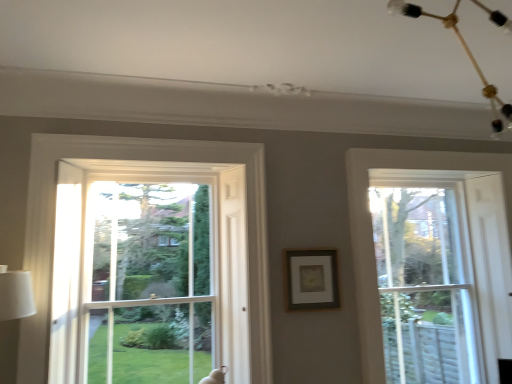
Identify the location of matte gold picture frame at center. (311, 279).

The height and width of the screenshot is (384, 512). I want to click on clear glass window at right, so click(x=371, y=228).

Where is `clear glass window screen at center`? This screenshot has height=384, width=512. clear glass window screen at center is located at coordinates (151, 284).

Is gold metallic chandelier at upper right wider than clear glass window screen at center?

Yes.

Is gold metallic chandelier at upper right facing towards clear glass window screen at center?

No, gold metallic chandelier at upper right does not turn towards clear glass window screen at center.

Is gold metallic chandelier at upper right not within clear glass window screen at center?

Yes, gold metallic chandelier at upper right is located beyond the bounds of clear glass window screen at center.

Looking at this image, from a real-world perspective, is gold metallic chandelier at upper right located higher than clear glass window screen at center?

Yes, from a real-world perspective, gold metallic chandelier at upper right is on top of clear glass window screen at center.

Is point (290, 253) positioned after point (133, 276)?

No, it is not.

Measure the distance between matte gold picture frame at center and clear glass window screen at center.

matte gold picture frame at center is 1.00 meters from clear glass window screen at center.

From a real-world perspective, is matte gold picture frame at center positioned over clear glass window screen at center based on gravity?

Incorrect, from a real-world perspective, matte gold picture frame at center is lower than clear glass window screen at center.

Does matte gold picture frame at center have a greater height compared to clear glass window screen at center?

No, matte gold picture frame at center is not taller than clear glass window screen at center.

Based on their sizes in the image, would you say gold metallic chandelier at upper right is bigger or smaller than clear glass window at right?

Clearly, gold metallic chandelier at upper right is smaller in size than clear glass window at right.

Are gold metallic chandelier at upper right and clear glass window at right located far from each other?

gold metallic chandelier at upper right is far away from clear glass window at right.

Choose the correct answer: Is gold metallic chandelier at upper right inside clear glass window at right or outside it?

gold metallic chandelier at upper right is located beyond the bounds of clear glass window at right.

Locate an element on the screen. light fixture above the clear glass window at right (from the image's perspective) is located at coordinates (466, 53).

The height and width of the screenshot is (384, 512). I want to click on window screen above the clear glass window at right (from a real-world perspective), so click(151, 284).

Which object is wider, clear glass window screen at center or clear glass window at right?

clear glass window screen at center.

Is clear glass window screen at center placed right next to clear glass window at right?

No, clear glass window screen at center is not making contact with clear glass window at right.

Could you tell me if clear glass window screen at center is turned towards clear glass window at right?

No, clear glass window screen at center is not turned towards clear glass window at right.

From the image's perspective, who appears lower, matte gold picture frame at center or clear glass window at right?

clear glass window at right appears lower in the image.

Is matte gold picture frame at center thinner than clear glass window at right?

Yes, matte gold picture frame at center is thinner than clear glass window at right.

In the image, is matte gold picture frame at center positioned in front of or behind clear glass window at right?

matte gold picture frame at center is in front of clear glass window at right.

Is clear glass window at right to the left of clear glass window screen at center from the viewer's perspective?

In fact, clear glass window at right is to the right of clear glass window screen at center.

Looking at this image, which point is more distant from viewer, (x=362, y=169) or (x=177, y=311)?

The point (x=362, y=169) is more distant.

Who is shorter, clear glass window at right or clear glass window screen at center?

clear glass window screen at center.

From the image's perspective, is clear glass window at right located above or below clear glass window screen at center?

→ Clearly, from the image's perspective, clear glass window at right is below clear glass window screen at center.

From their relative heights in the image, would you say matte gold picture frame at center is taller or shorter than gold metallic chandelier at upper right?

Clearly, matte gold picture frame at center is shorter compared to gold metallic chandelier at upper right.

Is matte gold picture frame at center next to gold metallic chandelier at upper right?

They are not placed beside each other.

Is matte gold picture frame at center oriented away from gold metallic chandelier at upper right?

No, gold metallic chandelier at upper right is not at the back of matte gold picture frame at center.

Is matte gold picture frame at center closer to the viewer compared to gold metallic chandelier at upper right?

No, the depth of matte gold picture frame at center is greater than that of gold metallic chandelier at upper right.

You are a GUI agent. You are given a task and a screenshot of the screen. Output one action in this format:
    pyautogui.click(x=<x>, y=<y>)
    Task: Click on the window screen behind the gold metallic chandelier at upper right
    
    Given the screenshot: What is the action you would take?
    pyautogui.click(x=151, y=284)

Find the location of `picture frame lying below the clear glass window screen at center (from the image's perspective)`. picture frame lying below the clear glass window screen at center (from the image's perspective) is located at coordinates (311, 279).

Estimate the real-world distances between objects in this image. Which object is closer to clear glass window at right, clear glass window screen at center or matte gold picture frame at center?

matte gold picture frame at center lies closer to clear glass window at right than the other object.

Which object lies further to the anchor point gold metallic chandelier at upper right, clear glass window at right or clear glass window screen at center?

Based on the image, clear glass window screen at center appears to be further to gold metallic chandelier at upper right.

Looking at the image, which one is located further to clear glass window screen at center, gold metallic chandelier at upper right or clear glass window at right?

gold metallic chandelier at upper right.

From the image, which object appears to be nearer to matte gold picture frame at center, clear glass window screen at center or gold metallic chandelier at upper right?

clear glass window screen at center is positioned closer to the anchor matte gold picture frame at center.

Based on their spatial positions, is clear glass window screen at center or clear glass window at right further from gold metallic chandelier at upper right?

clear glass window screen at center is further to gold metallic chandelier at upper right.

When comparing their distances from clear glass window screen at center, does matte gold picture frame at center or gold metallic chandelier at upper right seem further?

gold metallic chandelier at upper right is further to clear glass window screen at center.

Estimate the real-world distances between objects in this image. Which object is closer to clear glass window screen at center, gold metallic chandelier at upper right or matte gold picture frame at center?

matte gold picture frame at center is positioned closer to the anchor clear glass window screen at center.

Estimate the real-world distances between objects in this image. Which object is further from gold metallic chandelier at upper right, matte gold picture frame at center or clear glass window screen at center?

clear glass window screen at center.

Where is `picture frame situated between clear glass window screen at center and clear glass window at right from left to right`? Image resolution: width=512 pixels, height=384 pixels. picture frame situated between clear glass window screen at center and clear glass window at right from left to right is located at coordinates (311, 279).

Where is `picture frame located between gold metallic chandelier at upper right and clear glass window at right in the depth direction`? The width and height of the screenshot is (512, 384). picture frame located between gold metallic chandelier at upper right and clear glass window at right in the depth direction is located at coordinates (311, 279).

Locate an element on the screen. The image size is (512, 384). window screen positioned between gold metallic chandelier at upper right and clear glass window at right from near to far is located at coordinates (151, 284).

You are a GUI agent. You are given a task and a screenshot of the screen. Output one action in this format:
    pyautogui.click(x=<x>, y=<y>)
    Task: Click on the window screen between gold metallic chandelier at upper right and matte gold picture frame at center in the front-back direction
    This screenshot has height=384, width=512.
    Given the screenshot: What is the action you would take?
    pyautogui.click(x=151, y=284)